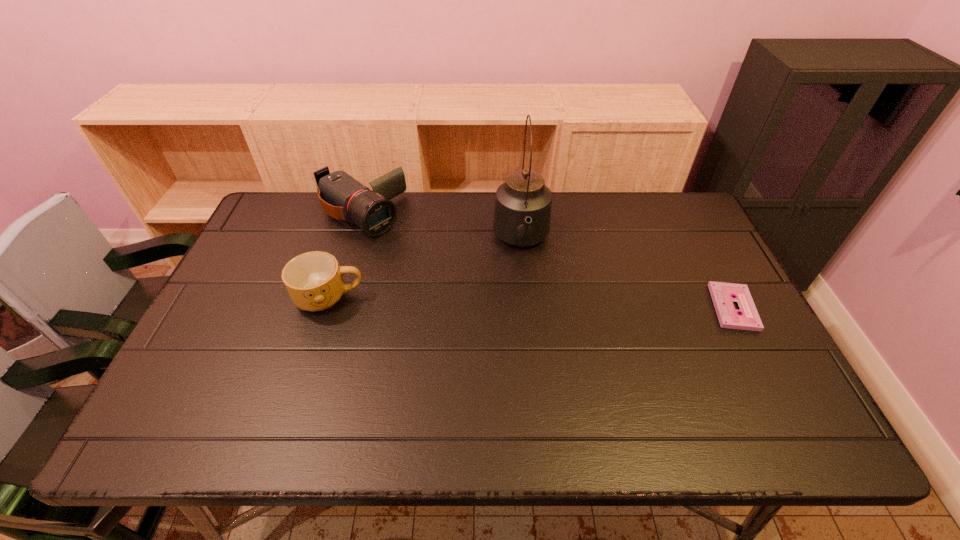
This screenshot has width=960, height=540. In order to click on the third tallest object in this screenshot , I will do `click(314, 281)`.

Find the location of a particular element. videotape is located at coordinates (723, 294).

Image resolution: width=960 pixels, height=540 pixels. Find the location of `the rightmost object`. the rightmost object is located at coordinates (723, 294).

Identify the location of camcorder. (341, 196).

The image size is (960, 540). I want to click on the third object from left to right, so click(522, 214).

Locate an element on the screen. the tallest object is located at coordinates (522, 214).

Where is `vacant space located on the side with the handle of the third tallest object`? This screenshot has width=960, height=540. vacant space located on the side with the handle of the third tallest object is located at coordinates (412, 298).

This screenshot has height=540, width=960. I want to click on free space located 0.360m on the left of the rightmost object, so click(577, 307).

Locate an element on the screen. Image resolution: width=960 pixels, height=540 pixels. vacant region located on the lens of the camcorder is located at coordinates (474, 300).

Image resolution: width=960 pixels, height=540 pixels. Find the location of `vacant space situated on the lens of the camcorder`. vacant space situated on the lens of the camcorder is located at coordinates (454, 285).